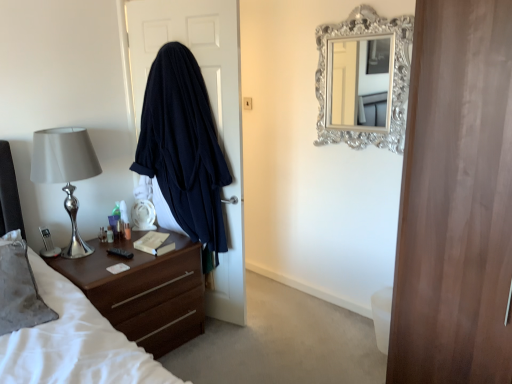
Question: In the image, is dark blue fabric at left on the left side or the right side of translucent plastic bottle at left, which appears as the 2th bottle when viewed from the left?

Choices:
 (A) left
 (B) right

Answer: (B)

Question: From the image's perspective, is dark blue fabric at left positioned above or below translucent plastic bottle at left, which appears as the 2th bottle when viewed from the left?

Choices:
 (A) below
 (B) above

Answer: (B)

Question: Which object is the closest to the silver metallic lamp at left?

Choices:
 (A) translucent plastic bottle at left, which is the second bottle from right to left
 (B) hardcover book at center
 (C) dark blue fabric at left
 (D) black plastic remote control at left
 (E) translucent plastic bottle at left, the first bottle positioned from the left

Answer: (A)

Question: Which object is positioned closest to the black plastic remote control at left?

Choices:
 (A) translucent plastic bottle at left, marked as the 3th bottle in a right-to-left arrangement
 (B) translucent plastic bottle at left, which appears as the 2th bottle when viewed from the left
 (C) translucent plastic bottle at bedside, the third bottle positioned from the left
 (D) silver ornate mirror at upper center
 (E) brown wood vanity at lower left

Answer: (C)